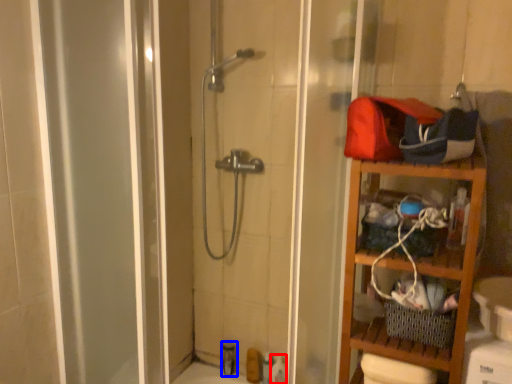
Question: Which point is further to the camera, toiletry (highlighted by a red box) or toiletry (highlighted by a blue box)?

Choices:
 (A) toiletry
 (B) toiletry

Answer: (B)